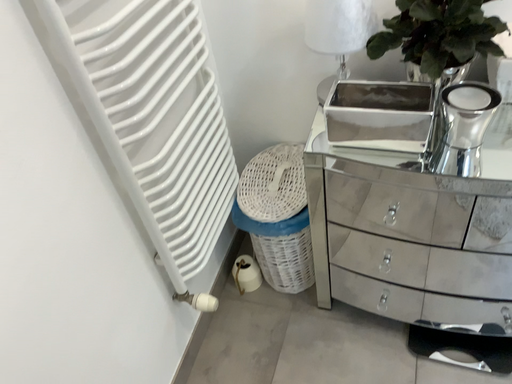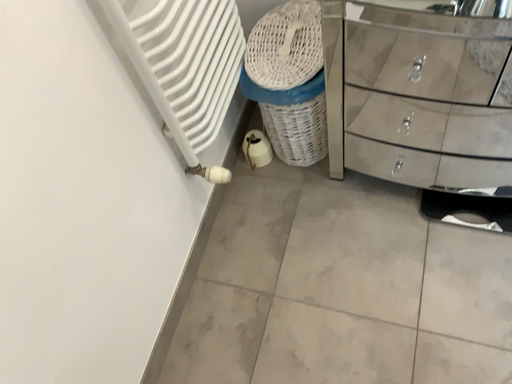
Question: How did the camera likely rotate when shooting the video?

Choices:
 (A) rotated downward
 (B) rotated upward

Answer: (A)